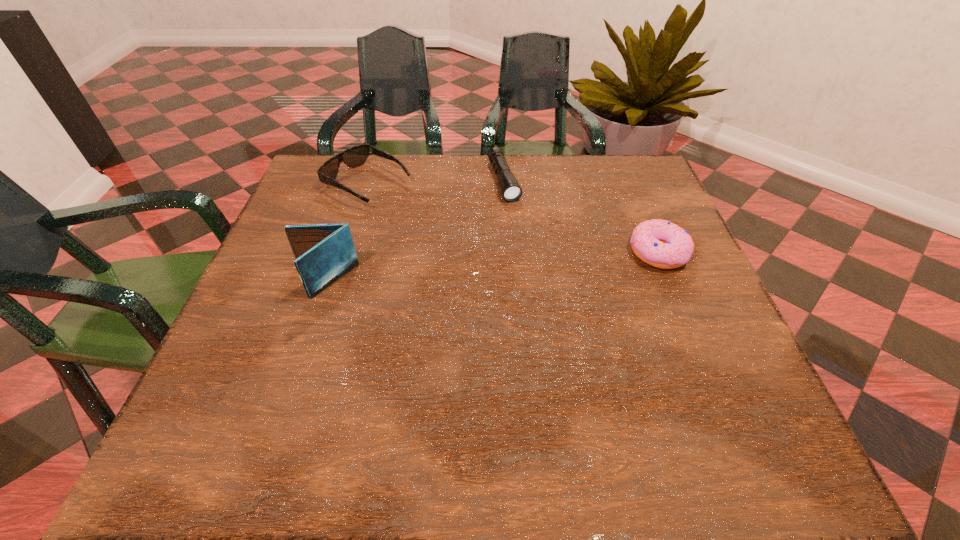
Where is `free point between the rightmost object and the second object from right to left`? free point between the rightmost object and the second object from right to left is located at coordinates (581, 217).

Where is `free space between the doughnut and the wallet`? free space between the doughnut and the wallet is located at coordinates (491, 267).

Find the location of `free area in between the doughnut and the sunglasses`. free area in between the doughnut and the sunglasses is located at coordinates (514, 219).

Identify which object is the closest to the sunglasses. Please provide its 2D coordinates. Your answer should be formatted as a tuple, i.e. [(x, y)], where the tuple contains the x and y coordinates of a point satisfying the conditions above.

[(324, 253)]

Identify the location of the third closest object to the wallet. (662, 244).

The image size is (960, 540). Identify the location of free space that satisfies the following two spatial constraints: 1. on the back side of the flashlight; 2. on the left side of the sunglasses. (370, 180).